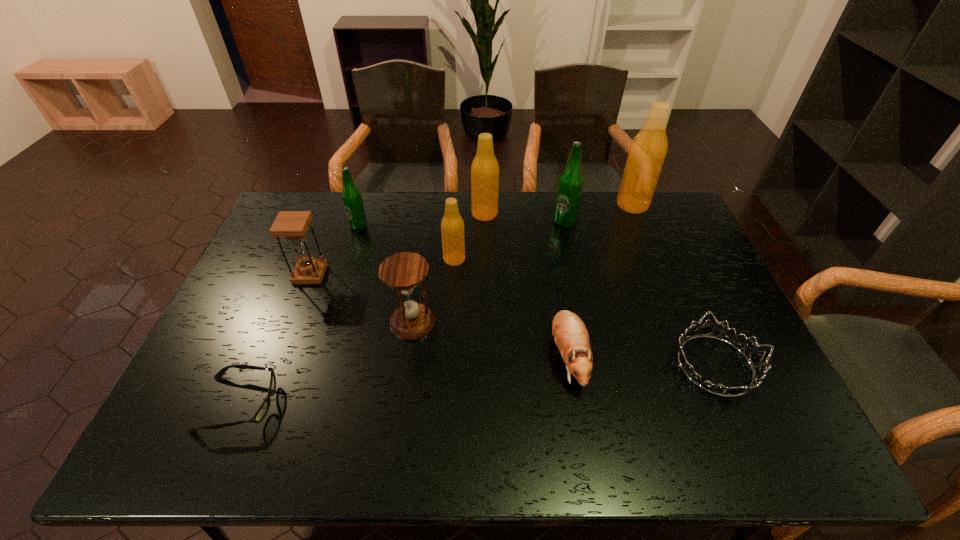
What are the coordinates of `blank space located 0.050m on the label of the third object from left to right` in the screenshot? It's located at (353, 241).

Find the location of a particular element. The width and height of the screenshot is (960, 540). vacant space located 0.300m on the front of the fifth object from left to right is located at coordinates (449, 345).

The width and height of the screenshot is (960, 540). I want to click on free space located on the right of the right hourglass, so click(571, 322).

Where is `vacant area located on the front of the farther hourglass`? This screenshot has width=960, height=540. vacant area located on the front of the farther hourglass is located at coordinates (264, 394).

Image resolution: width=960 pixels, height=540 pixels. I want to click on vacant space situated at the face of the third shortest object, so click(578, 420).

Find the location of a particular element. vacant space located 0.370m on the front-facing side of the second shortest object is located at coordinates (525, 365).

Locate an element on the screen. This screenshot has height=540, width=960. vacant space located on the front-facing side of the second shortest object is located at coordinates [572, 365].

Image resolution: width=960 pixels, height=540 pixels. I want to click on vacant space situated 0.240m on the front-facing side of the second shortest object, so click(x=576, y=365).

You are a GUI agent. You are given a task and a screenshot of the screen. Output one action in this format:
    pyautogui.click(x=<x>, y=<y>)
    Task: Click on the free space located 0.200m on the front-facing side of the spectacles
    The height and width of the screenshot is (540, 960).
    Given the screenshot: What is the action you would take?
    (x=359, y=404)

Find the location of a particular element. The width and height of the screenshot is (960, 540). object that is at the near edge is located at coordinates (264, 408).